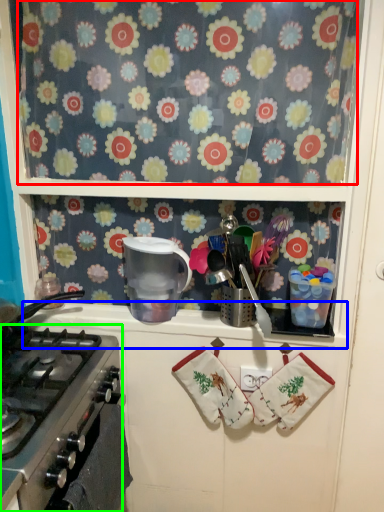
Question: Which object is the farthest from flower (highlighted by a red box)? Choose among these: counter top (highlighted by a blue box) or gas stove (highlighted by a green box).

Choices:
 (A) counter top
 (B) gas stove

Answer: (B)